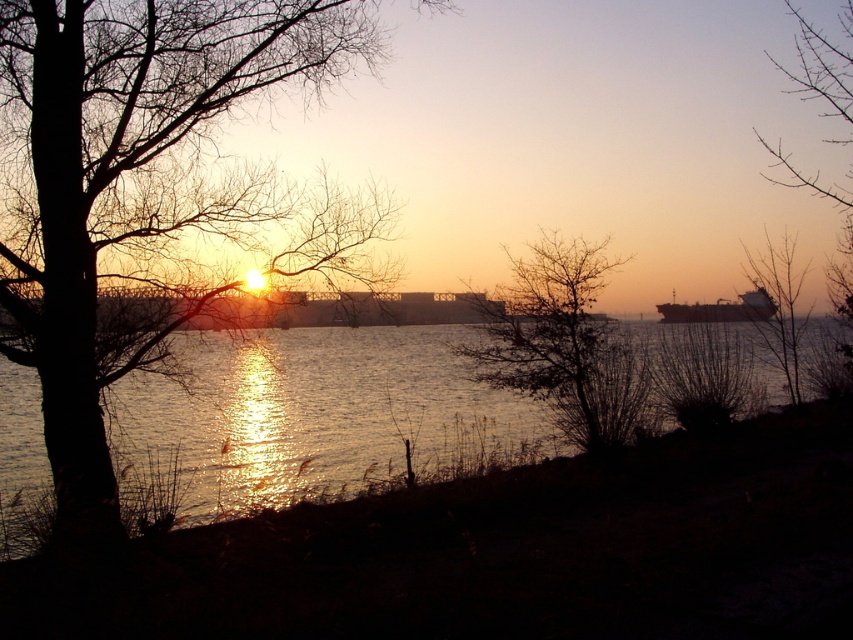
You are an architect designing a new observation deck. You want to place a large window facing the sunset. The window must be positioned so that the bare branches at center are centered in the window frame. Given the coordinates of the branches, what are the coordinates of the center of the window frame?

The coordinates of the center of the window frame should be the same as the position of the bare branches at center, which is at point (563, 344).

You are standing at the point marked as point (311, 420) in the image. What do you see directly in front of you?

You see glistening water at center directly in front of you at point (311, 420).